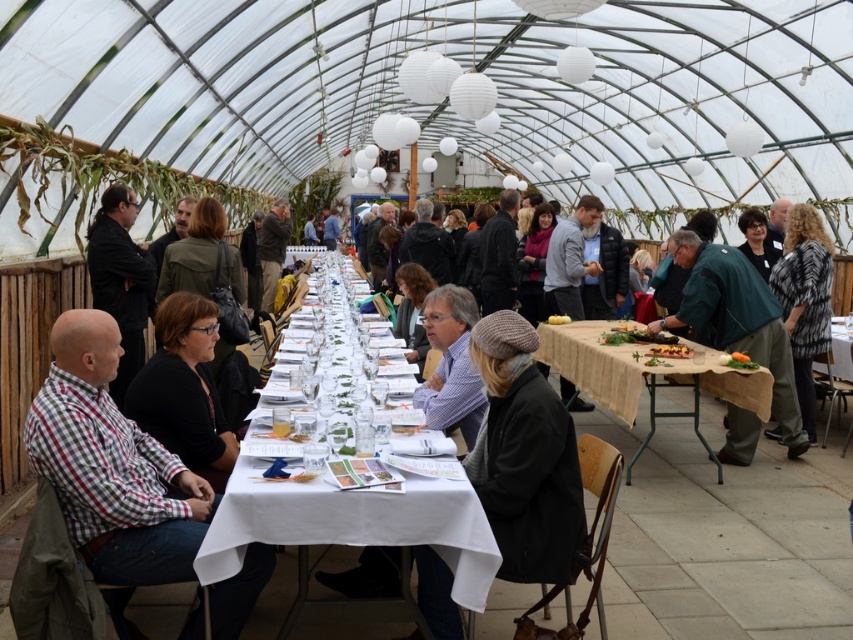
Question: Which object is farther from the camera taking this photo?

Choices:
 (A) printed fur coat at right
 (B) white paper table at lower right

Answer: (B)

Question: Can you confirm if white cloth table at center is positioned below wooden table at center?

Choices:
 (A) yes
 (B) no

Answer: (A)

Question: Which object is positioned closest to the wooden table at center?

Choices:
 (A) matte black jacket at center
 (B) green matte jacket at center
 (C) black leather jacket at left

Answer: (B)

Question: Does green matte jacket at center have a larger size compared to yellow matte pumpkin at center?

Choices:
 (A) no
 (B) yes

Answer: (B)

Question: Is wooden table at center to the right of printed fur coat at right from the viewer's perspective?

Choices:
 (A) yes
 (B) no

Answer: (B)

Question: Which is nearer to the matte black jacket at center?

Choices:
 (A) white cloth table at center
 (B) checkered fabric shirt at left

Answer: (B)